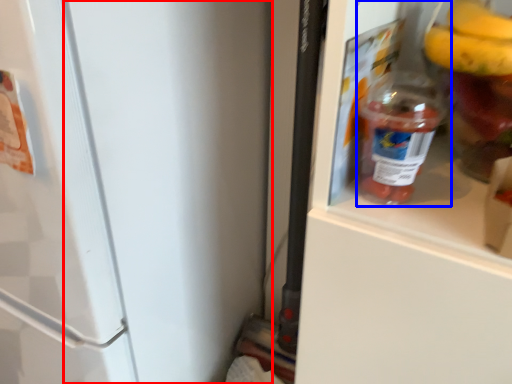
Question: Which point is further to the camera, door (highlighted by a red box) or bottle (highlighted by a blue box)?

Choices:
 (A) door
 (B) bottle

Answer: (B)